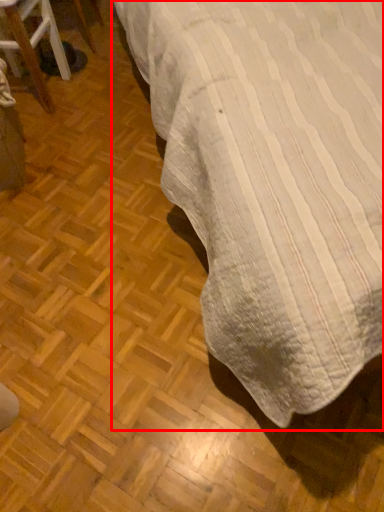
Question: From the image's perspective, considering the relative positions of table (annotated by the red box) and furniture in the image provided, where is table (annotated by the red box) located with respect to the staircase?

Choices:
 (A) below
 (B) above

Answer: (A)